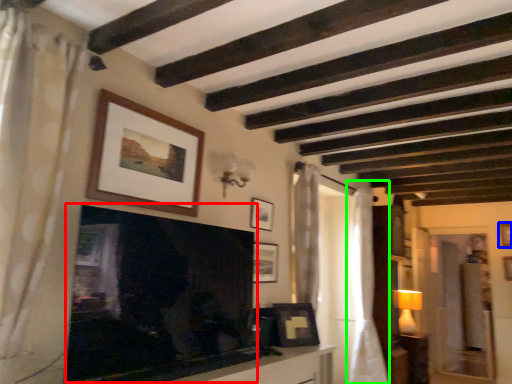
Question: Which object is the farthest from fireplace (highlighted by a red box)? Choose among these: picture frame (highlighted by a blue box) or curtain (highlighted by a green box).

Choices:
 (A) picture frame
 (B) curtain

Answer: (A)